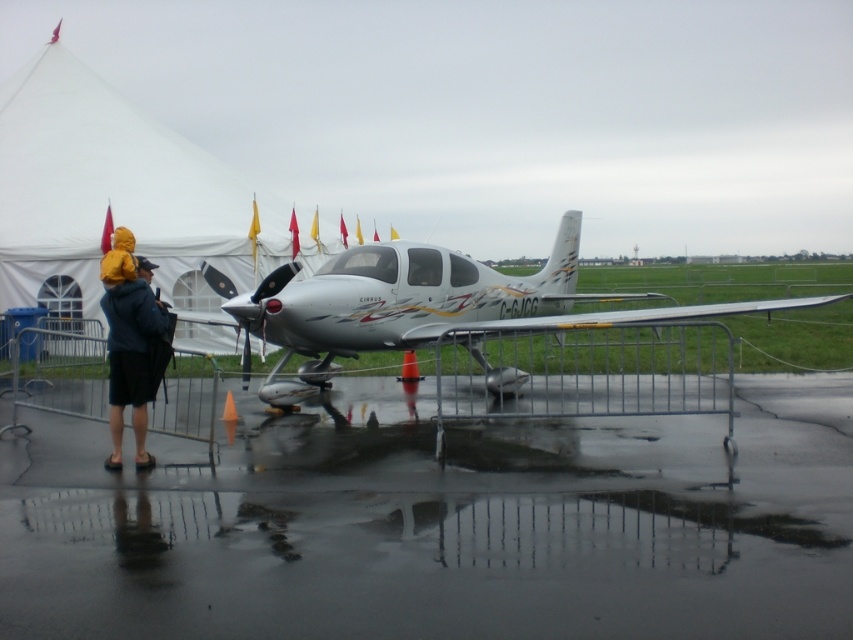
Is point (413, 460) behind point (136, 456)?

Yes, point (413, 460) is behind point (136, 456).

Which is behind, point (740, 452) or point (143, 397)?

Positioned behind is point (740, 452).

Who is more distant from viewer, (428,552) or (123,388)?

Point (123,388)

Where is `glossy asphalt tarmac at center`? glossy asphalt tarmac at center is located at coordinates (442, 525).

Consider the image. Is glossy asphalt tarmac at center to the left of white fabric tent at upper left from the viewer's perspective?

No, glossy asphalt tarmac at center is not to the left of white fabric tent at upper left.

Describe the element at coordinates (442, 525) in the screenshot. The width and height of the screenshot is (853, 640). I see `glossy asphalt tarmac at center` at that location.

The height and width of the screenshot is (640, 853). What do you see at coordinates (442, 525) in the screenshot? I see `glossy asphalt tarmac at center` at bounding box center [442, 525].

The image size is (853, 640). I want to click on glossy asphalt tarmac at center, so click(442, 525).

Does white fabric tent at upper left have a greater height compared to yellow waterproof jacket at left?

Yes, white fabric tent at upper left is taller than yellow waterproof jacket at left.

Is white fabric tent at upper left smaller than yellow waterproof jacket at left?

No.

Identify the location of white fabric tent at upper left. The image size is (853, 640). (115, 196).

Identify the location of white fabric tent at upper left. This screenshot has width=853, height=640. (115, 196).